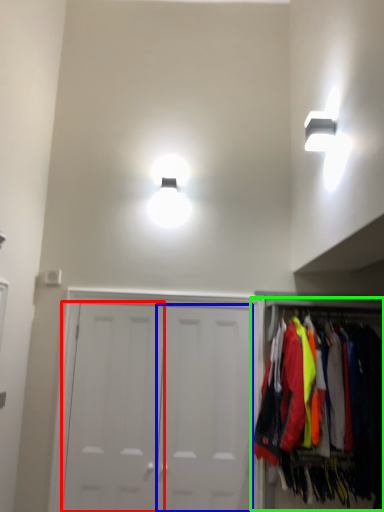
Question: Which object is the farthest from door (highlighted by a red box)? Choose among these: door (highlighted by a blue box) or closet (highlighted by a green box).

Choices:
 (A) door
 (B) closet

Answer: (B)